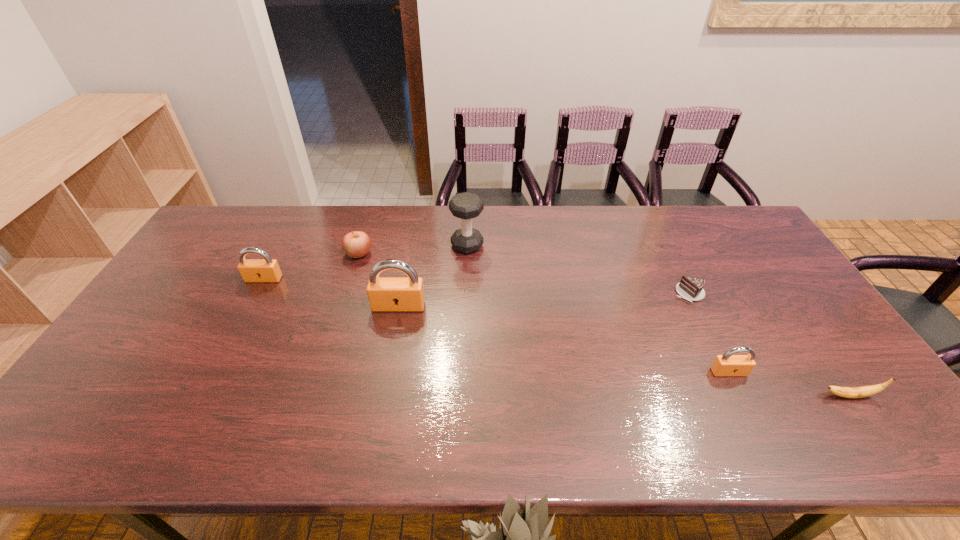
Find the location of a particular element. This screenshot has height=540, width=960. the rightmost object is located at coordinates (848, 392).

Where is `vacant space positioned to unlock the fifth shortest object from the front`? Image resolution: width=960 pixels, height=540 pixels. vacant space positioned to unlock the fifth shortest object from the front is located at coordinates (243, 320).

Where is `free spot located 0.200m to unlock the tallest padlock from the front`? free spot located 0.200m to unlock the tallest padlock from the front is located at coordinates (387, 371).

Locate an element on the screen. vacant point located 0.210m on the back of the shortest object is located at coordinates (663, 240).

At what (x,y) coordinates should I click in order to perform the action: click on vacant space located on the front of the apple. Please return your answer as a coordinate pair (x, y). Looking at the image, I should click on (327, 356).

I want to click on free space located on the back of the fourth object from right to left, so click(x=468, y=224).

This screenshot has width=960, height=540. Find the location of `free space located 0.340m on the peel of the banana from the top`. free space located 0.340m on the peel of the banana from the top is located at coordinates (681, 396).

Find the location of a particular element. blank space located 0.340m on the peel of the banana from the top is located at coordinates (681, 396).

Where is `vacant space located on the peel of the banana from the top`? vacant space located on the peel of the banana from the top is located at coordinates (656, 396).

Identify the location of apple that is at the far edge. The height and width of the screenshot is (540, 960). [356, 244].